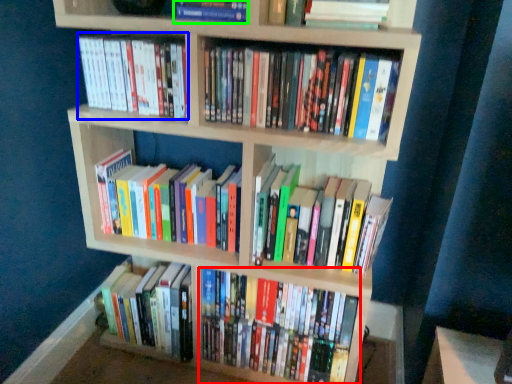
Question: Which object is positioned farthest from book (highlighted by a red box)? Select from book (highlighted by a blue box) and book (highlighted by a green box).

Choices:
 (A) book
 (B) book

Answer: (B)